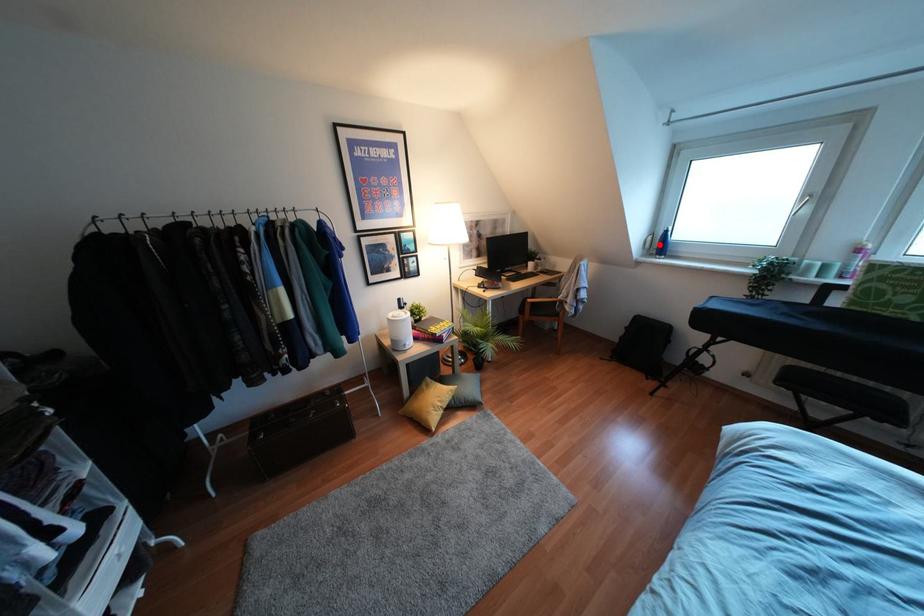
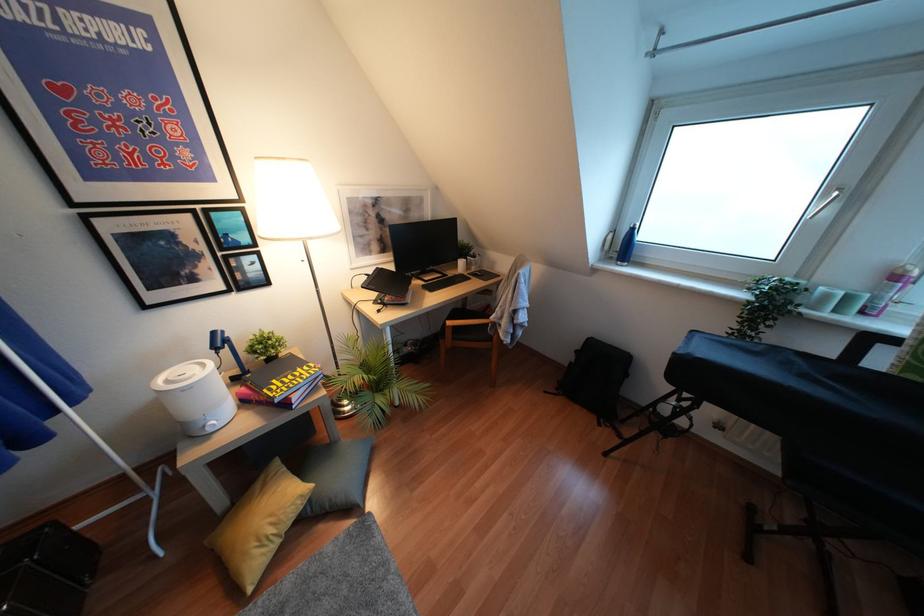
Find the pixel in the second image that matches the highlighted location in the first image.

(623, 246)